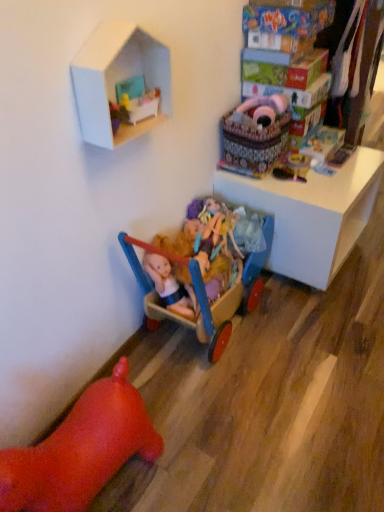
Where is `vacant space to the right of wooden wagon at lower center, which is the 5th toy in right-to-left order`? The image size is (384, 512). vacant space to the right of wooden wagon at lower center, which is the 5th toy in right-to-left order is located at coordinates (317, 337).